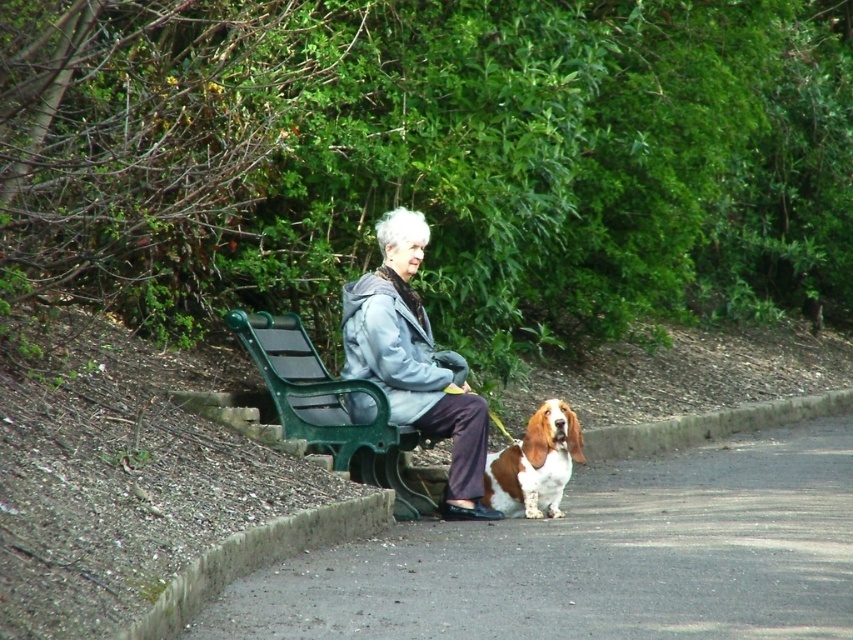
Question: Which of the following is the farthest from the observer?

Choices:
 (A) (498, 499)
 (B) (305, 340)

Answer: (B)

Question: Which point appears farthest from the camera in this image?

Choices:
 (A) (427, 410)
 (B) (384, 589)
 (C) (292, 323)
 (D) (509, 497)

Answer: (C)

Question: Is green plastic bench at center wider than brown and white fur at lower center?

Choices:
 (A) yes
 (B) no

Answer: (A)

Question: Can you confirm if smooth asphalt road at lower center is positioned to the left of green plastic bench at center?

Choices:
 (A) yes
 (B) no

Answer: (B)

Question: Does green plastic bench at center have a greater width compared to brown and white fur at lower center?

Choices:
 (A) yes
 (B) no

Answer: (A)

Question: Which of the following is the closest to the observer?

Choices:
 (A) green plastic bench at center
 (B) gray fleece jacket at center
 (C) brown and white fur at lower center
 (D) smooth asphalt road at lower center

Answer: (D)